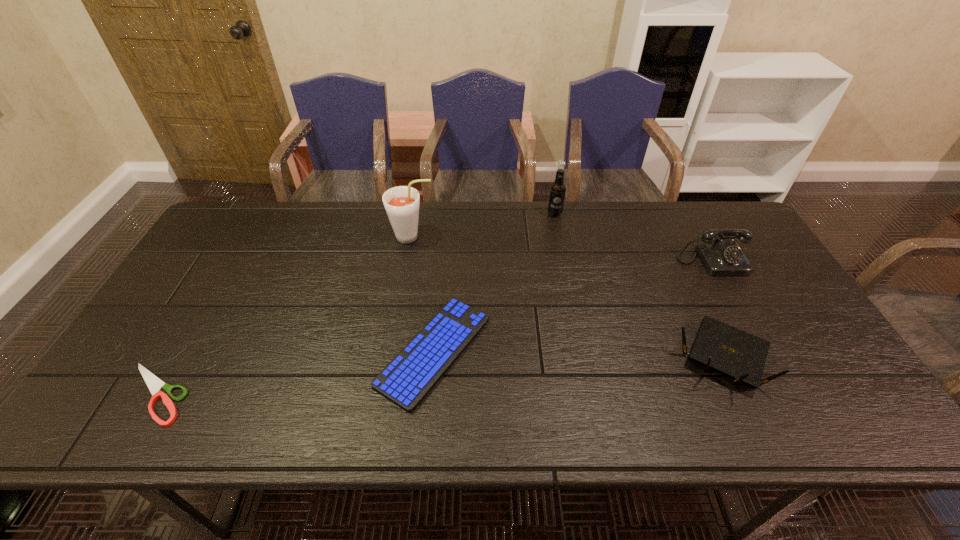
At what (x,y) coordinates should I click in order to perform the action: click on free region at the far edge. Please return your answer as a coordinate pair (x, y). The height and width of the screenshot is (540, 960). Looking at the image, I should click on (543, 208).

Locate an element on the screen. The height and width of the screenshot is (540, 960). free region at the near edge of the desktop is located at coordinates (772, 418).

This screenshot has width=960, height=540. What are the coordinates of `vacant space at the right edge of the desktop` in the screenshot? It's located at (810, 330).

Locate an element on the screen. free region at the far right corner of the desktop is located at coordinates (705, 224).

Locate an element on the screen. This screenshot has height=540, width=960. free spot between the left root beer and the shortest object is located at coordinates [283, 315].

You are a GUI agent. You are given a task and a screenshot of the screen. Output one action in this format:
    pyautogui.click(x=<x>, y=<y>)
    Task: Click on the free spot between the telephone and the farthest object
    The width and height of the screenshot is (960, 540).
    Given the screenshot: What is the action you would take?
    coord(634,238)

The height and width of the screenshot is (540, 960). In order to click on free spot between the computer keyboard and the nearer root beer in this screenshot , I will do `click(423, 294)`.

I want to click on free space between the scissors and the right root beer, so click(x=354, y=304).

Locate an element on the screen. The image size is (960, 540). empty space that is in between the nearer root beer and the router is located at coordinates click(x=567, y=296).

The width and height of the screenshot is (960, 540). I want to click on vacant region between the telephone and the third object from right to left, so click(634, 238).